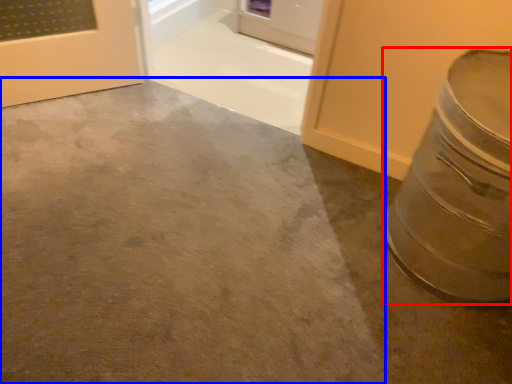
Question: Which object is closer to the camera taking this photo, crock pot (highlighted by a red box) or concrete (highlighted by a blue box)?

Choices:
 (A) crock pot
 (B) concrete

Answer: (B)